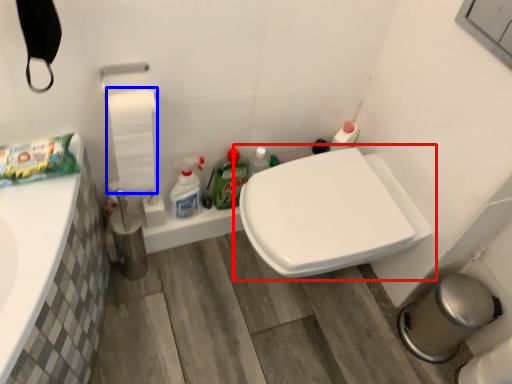
Question: Which of the following is the farthest to the observer, toilet (highlighted by a red box) or toilet paper (highlighted by a blue box)?

Choices:
 (A) toilet
 (B) toilet paper

Answer: (A)